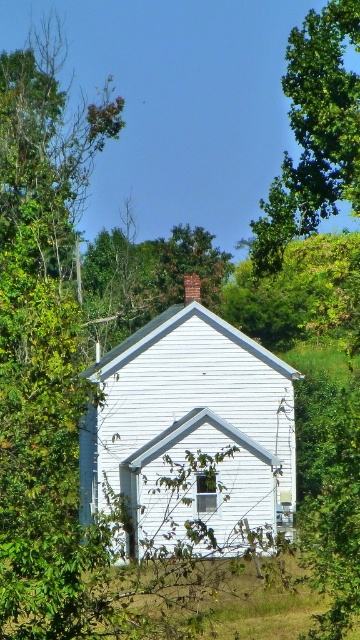
You are standing in front of the white wooden structure and notice a green leafy tree at upper center. Based on its position, can you determine if the tree is closer to the top or the bottom of the image?

The green leafy tree at upper center is located at point (313, 134), which means it is closer to the top of the image since the y coordinate is higher.

You are standing in front of the white wooden structure and notice two objects at the upper center of the image. Which one, the green leafy tree at upper center or the brick chimney at upper center, is wider?

The green leafy tree at upper center is wider than the brick chimney at upper center according to the description.